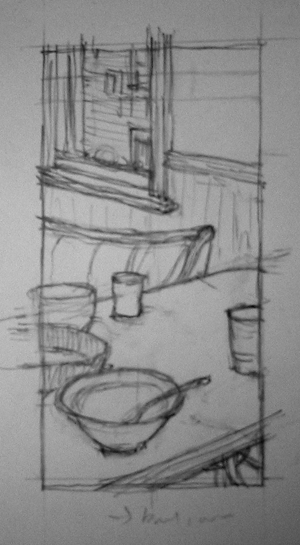
Locate an element on the screen. spoon is located at coordinates (190, 387).